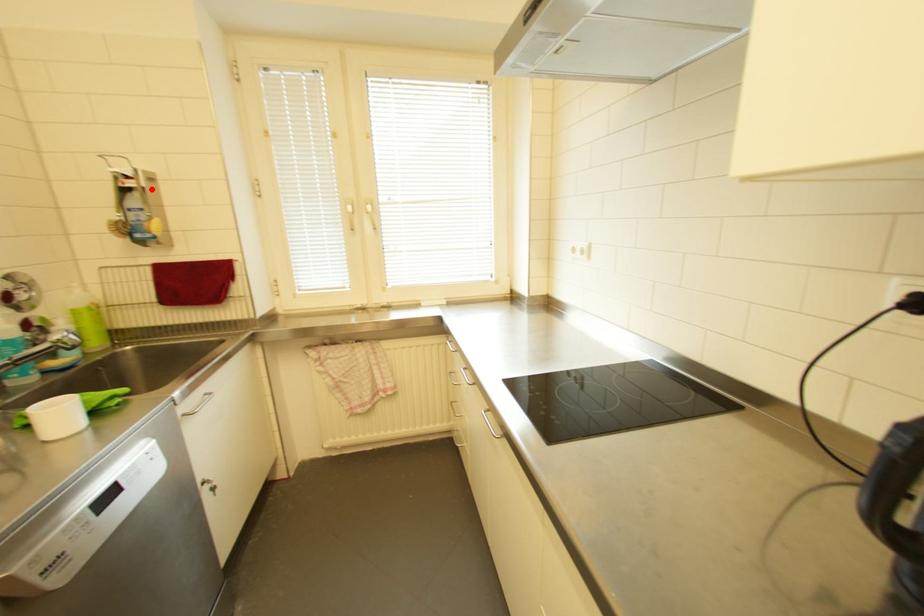
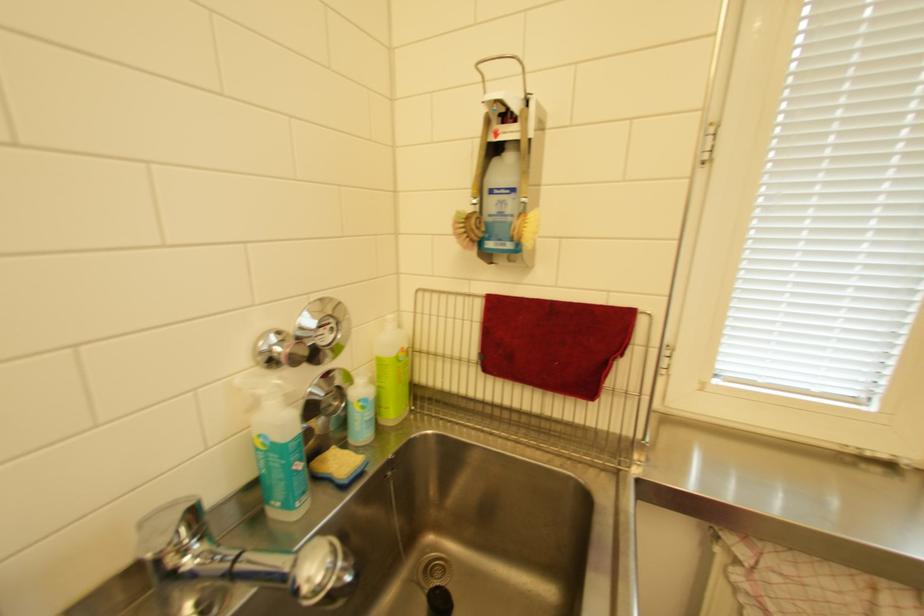
In the second image, find the point that corresponds to the highlighted location in the first image.

(537, 140)